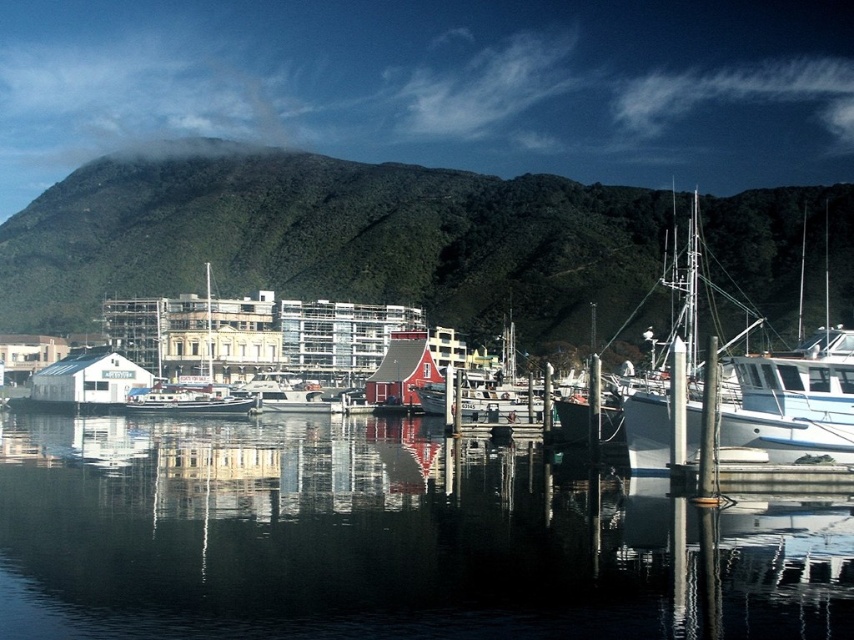
You are a photographer standing at the harbor and want to take a picture of the green forested mountain at upper center. If your camera has a maximum focus range of 150 meters, will you be able to capture the mountain clearly?

The green forested mountain at upper center is 155.00 meters away from the viewer. Since the camera can only focus up to 150 meters, it will not be able to capture the mountain clearly.

You are a photographer positioned at the center of the image. You want to capture the green forested mountain at upper center in your shot. According to the coordinates provided, where should you aim your camera?

The green forested mountain at upper center is located at coordinates point (331,237), so you should aim your camera towards that point to capture it.

You are a delivery drone navigating the harbor scene. You need to fly from your current position to a drop point. There are two reference points marked as point A and point B in the image. Point A is at coordinate point [171,484] and point B is at coordinate point [159,358]. Based on the scene description, which point is closer to the wooden piers where the boats are docked?

Point A at coordinate point [171,484] is in front of point B at coordinate point [159,358]. Since the wooden piers are in the foreground of the image, point A is closer to the wooden piers where the boats are docked.